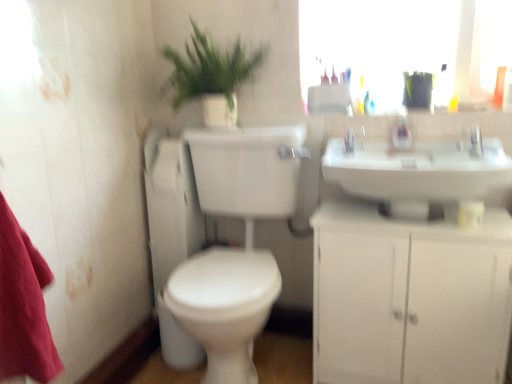
Question: From the image's perspective, is satin nickel faucet at upper center located beneath white glossy toilet at center-left?

Choices:
 (A) no
 (B) yes

Answer: (A)

Question: Is satin nickel faucet at upper center positioned with its back to white glossy toilet at center-left?

Choices:
 (A) no
 (B) yes

Answer: (A)

Question: Does satin nickel faucet at upper center have a lesser width compared to white glossy toilet at center-left?

Choices:
 (A) no
 (B) yes

Answer: (B)

Question: From a real-world perspective, does satin nickel faucet at upper center stand above white glossy toilet at center-left?

Choices:
 (A) no
 (B) yes

Answer: (B)

Question: Could white glossy toilet at center-left be considered to be inside satin nickel faucet at upper center?

Choices:
 (A) no
 (B) yes

Answer: (A)

Question: Visually, is white glossy toilet at center-left positioned to the left or to the right of silver metallic faucet at upper right?

Choices:
 (A) left
 (B) right

Answer: (A)

Question: Is white glossy toilet at center-left in front of or behind silver metallic faucet at upper right in the image?

Choices:
 (A) behind
 (B) front

Answer: (A)

Question: From the image's perspective, is white glossy toilet at center-left located above or below silver metallic faucet at upper right?

Choices:
 (A) below
 (B) above

Answer: (A)

Question: Looking at their shapes, would you say white glossy toilet at center-left is wider or thinner than silver metallic faucet at upper right?

Choices:
 (A) thin
 (B) wide

Answer: (B)

Question: Is silver metallic faucet at upper right spatially inside white matte cabinet at lower right, or outside of it?

Choices:
 (A) inside
 (B) outside

Answer: (B)

Question: From a real-world perspective, is silver metallic faucet at upper right above or below white matte cabinet at lower right?

Choices:
 (A) below
 (B) above

Answer: (B)

Question: From their relative heights in the image, would you say silver metallic faucet at upper right is taller or shorter than white matte cabinet at lower right?

Choices:
 (A) tall
 (B) short

Answer: (B)

Question: In the image, is silver metallic faucet at upper right on the left side or the right side of white matte cabinet at lower right?

Choices:
 (A) left
 (B) right

Answer: (B)

Question: From a real-world perspective, is green leafy plant at upper center above or below white matte cabinet at lower right?

Choices:
 (A) below
 (B) above

Answer: (B)

Question: Which is correct: green leafy plant at upper center is inside white matte cabinet at lower right, or outside of it?

Choices:
 (A) inside
 (B) outside

Answer: (B)